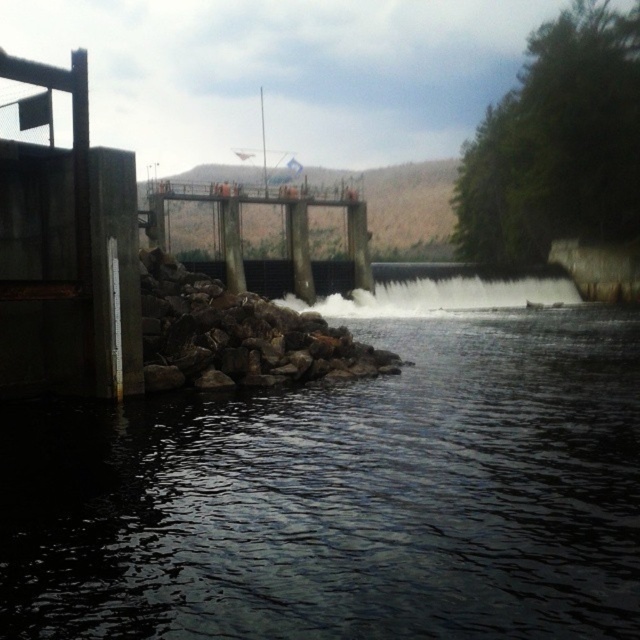
Between dark gray water at lower left and rocky pile at lower left, which one is positioned higher?

rocky pile at lower left

Locate an element on the screen. dark gray water at lower left is located at coordinates (x=344, y=497).

This screenshot has height=640, width=640. I want to click on dark gray water at lower left, so click(x=344, y=497).